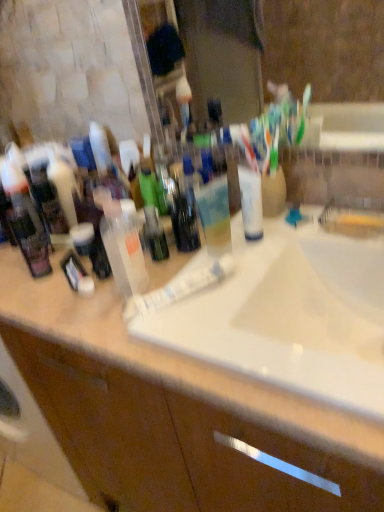
Find the location of a particular element. Image resolution: width=384 pixels, height=512 pixels. vacant space to the right of white glossy tube at center is located at coordinates (267, 276).